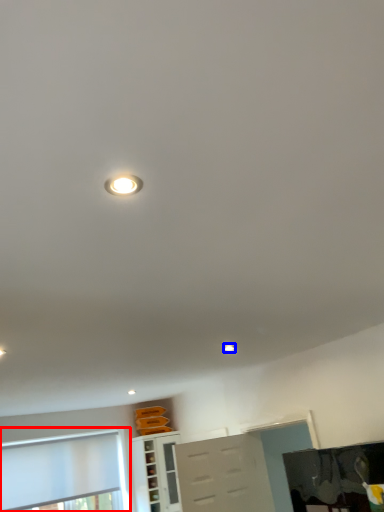
Question: Which point is further to the camera, window (highlighted by a red box) or droplight (highlighted by a blue box)?

Choices:
 (A) window
 (B) droplight

Answer: (A)